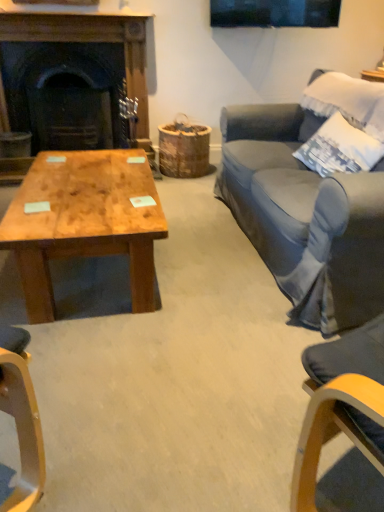
Question: In the image, is white cotton pillow at upper right positioned in front of or behind natural wood coffee table at lower left?

Choices:
 (A) behind
 (B) front

Answer: (A)

Question: From a real-world perspective, is white cotton pillow at upper right above or below natural wood coffee table at lower left?

Choices:
 (A) above
 (B) below

Answer: (A)

Question: Which object is the closest to the dark wood fireplace at left?

Choices:
 (A) natural wood coffee table at lower left
 (B) white cotton pillow at upper right

Answer: (A)

Question: Which of these objects is positioned farthest from the dark wood fireplace at left?

Choices:
 (A) white cotton pillow at upper right
 (B) natural wood coffee table at lower left

Answer: (A)